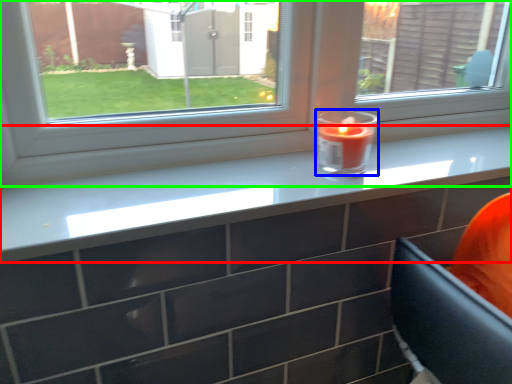
Question: Estimate the real-world distances between objects in this image. Which object is closer to counter top (highlighted by a red box), birthday candle (highlighted by a blue box) or window (highlighted by a green box)?

Choices:
 (A) birthday candle
 (B) window

Answer: (B)